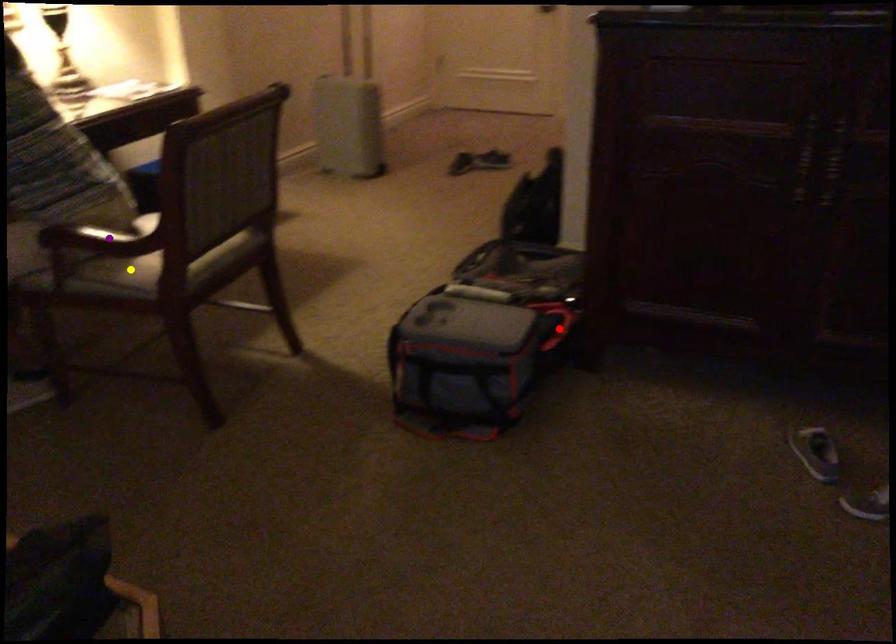
Order these from nearest to farthest:
yellow point, red point, purple point

purple point, yellow point, red point